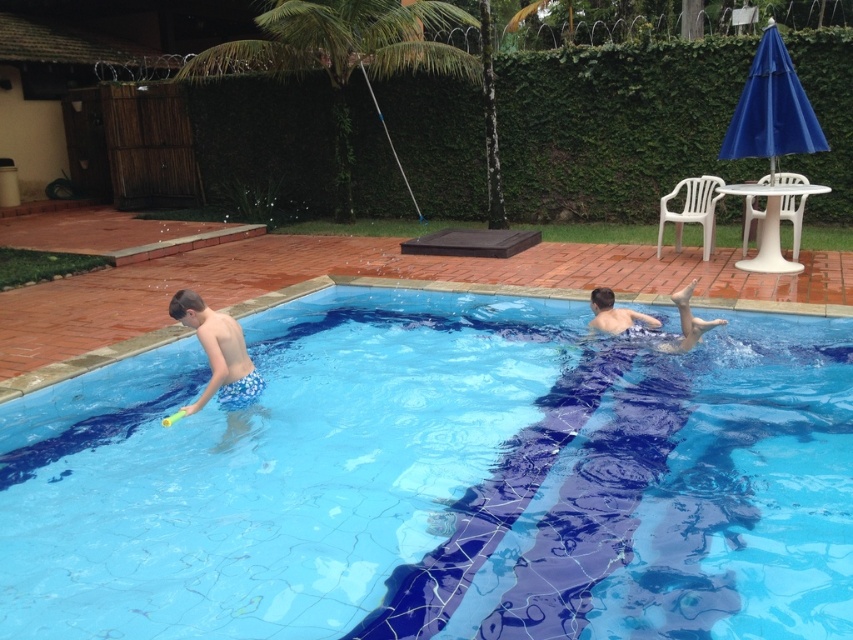
Question: Is blue printed shorts at lower left bigger than smooth skin person at center?

Choices:
 (A) yes
 (B) no

Answer: (B)

Question: Based on their relative distances, which object is farther from the blue printed shorts at lower left?

Choices:
 (A) blue mosaic tiles at center
 (B) smooth skin person at center

Answer: (B)

Question: Which object is closer to the camera taking this photo?

Choices:
 (A) blue mosaic tiles at center
 (B) smooth skin person at center
 (C) blue printed shorts at lower left

Answer: (C)

Question: Does blue mosaic tiles at center lie in front of smooth skin person at center?

Choices:
 (A) no
 (B) yes

Answer: (B)

Question: Does blue mosaic tiles at center lie behind smooth skin person at center?

Choices:
 (A) yes
 (B) no

Answer: (B)

Question: Which point is closer to the camera?

Choices:
 (A) (235, 356)
 (B) (346, 419)

Answer: (A)